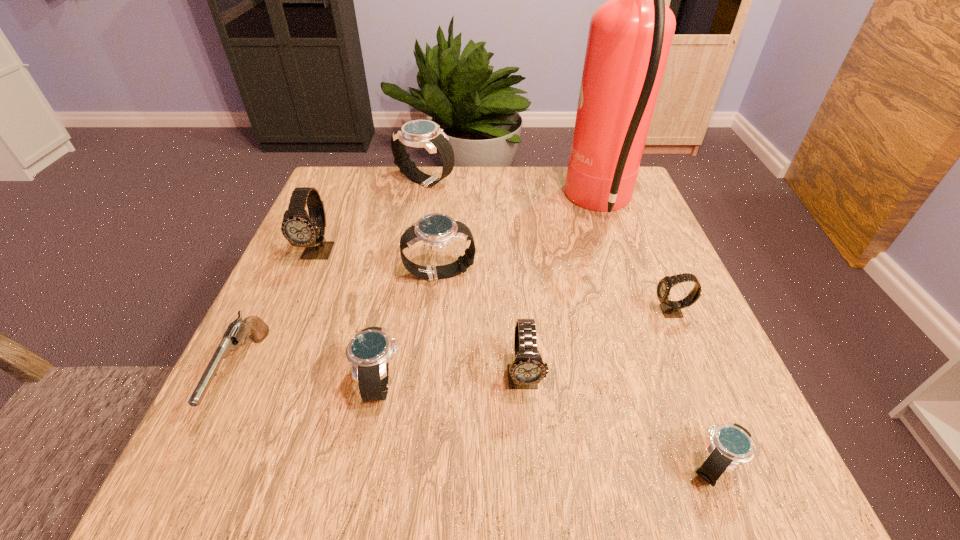
You are a GUI agent. You are given a task and a screenshot of the screen. Output one action in this format:
    pyautogui.click(x=<x>, y=<y>)
    Task: Click on the free location located 0.230m on the back of the second biggest silver watch
    Image resolution: width=960 pixels, height=540 pixels.
    Given the screenshot: What is the action you would take?
    pyautogui.click(x=446, y=200)

At what (x,y) coordinates should I click in order to perform the action: click on vacant space located 0.050m on the face of the sixth object from left to right. Please return your answer as a coordinate pair (x, y). Image resolution: width=960 pixels, height=540 pixels. Looking at the image, I should click on (528, 433).

The image size is (960, 540). I want to click on blank space located 0.070m on the left of the second nearest silver watch, so click(x=315, y=383).

The width and height of the screenshot is (960, 540). I want to click on vacant space situated on the face of the fourth nearest watch, so click(621, 312).

Find the location of a particular element. vacant region located 0.270m on the face of the fourth nearest watch is located at coordinates (511, 312).

I want to click on free space located on the face of the fourth nearest watch, so click(448, 312).

You are a GUI agent. You are given a task and a screenshot of the screen. Output one action in this format:
    pyautogui.click(x=<x>, y=<y>)
    Task: Click on the vacant space situated 0.060m aiming along the barrel of the gun
    The height and width of the screenshot is (540, 960).
    Given the screenshot: What is the action you would take?
    pyautogui.click(x=197, y=474)

Identify the location of vacant space located 0.060m on the back of the rightmost silver watch. The height and width of the screenshot is (540, 960). click(690, 406).

Where is `fire extinguisher at the far edge`? This screenshot has width=960, height=540. fire extinguisher at the far edge is located at coordinates (629, 39).

The width and height of the screenshot is (960, 540). In order to click on watch present at the far edge in this screenshot , I will do `click(418, 133)`.